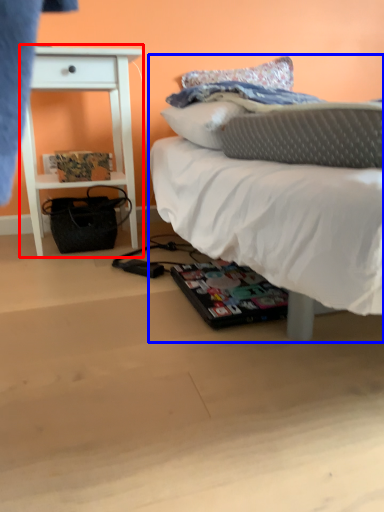
Question: Which point is closer to the camera, nightstand (highlighted by a red box) or bed (highlighted by a blue box)?

Choices:
 (A) nightstand
 (B) bed

Answer: (B)